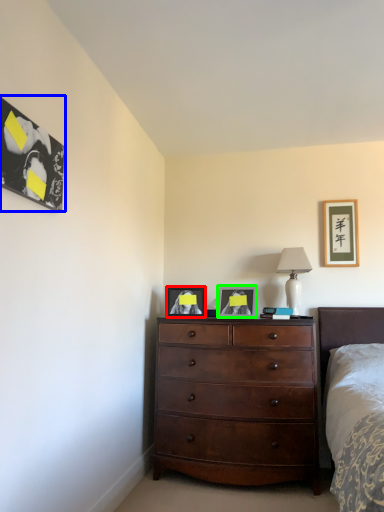
Question: Based on their relative distances, which object is nearer to picture frame (highlighted by a red box)? Choose from picture frame (highlighted by a blue box) and picture frame (highlighted by a green box).

Choices:
 (A) picture frame
 (B) picture frame

Answer: (B)